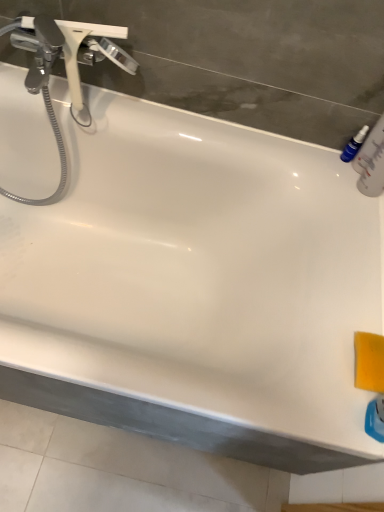
The width and height of the screenshot is (384, 512). Describe the element at coordinates (354, 144) in the screenshot. I see `blue plastic bottle at upper right` at that location.

In order to click on blue plastic bottle at upper right in this screenshot , I will do `click(354, 144)`.

Measure the distance between point (356, 151) and camera.

Point (356, 151) and camera are 1.02 meters apart.

In the scene shown: What is the approximate height of chrome metallic faucet at upper left?

The height of chrome metallic faucet at upper left is 11.01 inches.

What do you see at coordinates (67, 53) in the screenshot?
I see `chrome metallic faucet at upper left` at bounding box center [67, 53].

Locate an element on the screen. The image size is (384, 512). chrome metallic faucet at upper left is located at coordinates (67, 53).

Image resolution: width=384 pixels, height=512 pixels. Identify the location of blue plastic bottle at upper right. (354, 144).

Is chrome metallic faucet at upper left at the left side of blue plastic bottle at upper right?

Yes.

Consider the image. In the image, is chrome metallic faucet at upper left positioned in front of or behind blue plastic bottle at upper right?

Visually, chrome metallic faucet at upper left is located in front of blue plastic bottle at upper right.

Is point (65, 41) farther from viewer compared to point (354, 139)?

No, (65, 41) is in front of (354, 139).

From the image's perspective, which one is positioned lower, chrome metallic faucet at upper left or blue plastic bottle at upper right?

From the image's view, blue plastic bottle at upper right is below.

From a real-world perspective, is chrome metallic faucet at upper left over blue plastic bottle at upper right?

Yes, from a real-world perspective, chrome metallic faucet at upper left is above blue plastic bottle at upper right.

Can you confirm if chrome metallic faucet at upper left is wider than blue plastic bottle at upper right?

Correct, the width of chrome metallic faucet at upper left exceeds that of blue plastic bottle at upper right.

Can you confirm if chrome metallic faucet at upper left is shorter than blue plastic bottle at upper right?

No.

Between chrome metallic faucet at upper left and blue plastic bottle at upper right, which one has larger size?

chrome metallic faucet at upper left.

Is blue plastic bottle at upper right a part of chrome metallic faucet at upper left?

No, chrome metallic faucet at upper left does not contain blue plastic bottle at upper right.

Are chrome metallic faucet at upper left and blue plastic bottle at upper right making contact?

No, chrome metallic faucet at upper left is not beside blue plastic bottle at upper right.

Is chrome metallic faucet at upper left looking in the opposite direction of blue plastic bottle at upper right?

No.

What's the angular difference between chrome metallic faucet at upper left and blue plastic bottle at upper right's facing directions?

The angle between the facing direction of chrome metallic faucet at upper left and the facing direction of blue plastic bottle at upper right is 86.4 degrees.

Identify the location of tap that is on the left side of blue plastic bottle at upper right. The image size is (384, 512). (67, 53).

Visually, is blue plastic bottle at upper right positioned to the left or to the right of chrome metallic faucet at upper left?

blue plastic bottle at upper right is to the right of chrome metallic faucet at upper left.

Is blue plastic bottle at upper right positioned behind chrome metallic faucet at upper left?

Yes.

Which is less distant, (361, 130) or (71, 21)?

Clearly, point (361, 130) is more distant from the camera than point (71, 21).

From the image's perspective, does blue plastic bottle at upper right appear lower than chrome metallic faucet at upper left?

A: Correct, blue plastic bottle at upper right appears lower than chrome metallic faucet at upper left in the image.

From a real-world perspective, is blue plastic bottle at upper right located higher than chrome metallic faucet at upper left?

No, from a real-world perspective, blue plastic bottle at upper right is not over chrome metallic faucet at upper left

Is blue plastic bottle at upper right wider than chrome metallic faucet at upper left?

Incorrect, the width of blue plastic bottle at upper right does not surpass that of chrome metallic faucet at upper left.

Considering the sizes of blue plastic bottle at upper right and chrome metallic faucet at upper left in the image, is blue plastic bottle at upper right taller or shorter than chrome metallic faucet at upper left?

Clearly, blue plastic bottle at upper right is shorter compared to chrome metallic faucet at upper left.

Considering the relative sizes of blue plastic bottle at upper right and chrome metallic faucet at upper left in the image provided, is blue plastic bottle at upper right smaller than chrome metallic faucet at upper left?

Correct, blue plastic bottle at upper right occupies less space than chrome metallic faucet at upper left.

Is blue plastic bottle at upper right located outside chrome metallic faucet at upper left?

Yes, blue plastic bottle at upper right is not within chrome metallic faucet at upper left.

Is blue plastic bottle at upper right directly adjacent to chrome metallic faucet at upper left?

No, blue plastic bottle at upper right is not beside chrome metallic faucet at upper left.

Based on the photo, could you tell me if blue plastic bottle at upper right is facing chrome metallic faucet at upper left?

Yes, blue plastic bottle at upper right is oriented towards chrome metallic faucet at upper left.

From the picture: What's the angular difference between blue plastic bottle at upper right and chrome metallic faucet at upper left's facing directions?

There is a 86.4-degree angle between the facing directions of blue plastic bottle at upper right and chrome metallic faucet at upper left.

This screenshot has height=512, width=384. What are the coordinates of `mouthwash behind the chrome metallic faucet at upper left` in the screenshot? It's located at (354, 144).

Where is `mouthwash that is on the right side of chrome metallic faucet at upper left`? The image size is (384, 512). mouthwash that is on the right side of chrome metallic faucet at upper left is located at coordinates (354, 144).

What are the coordinates of `tap lying in front of the blue plastic bottle at upper right` in the screenshot? It's located at (67, 53).